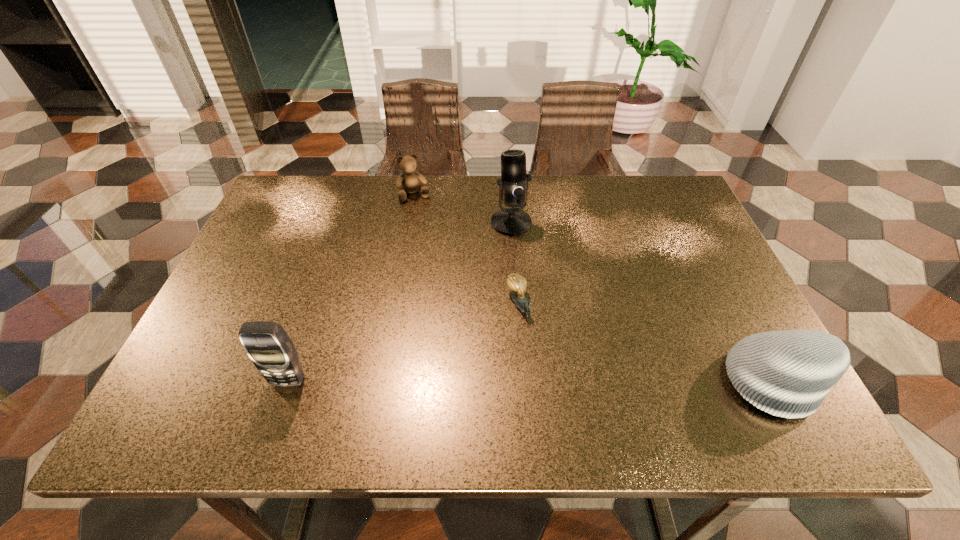
The height and width of the screenshot is (540, 960). Find the location of `the leftmost object`. the leftmost object is located at coordinates (267, 344).

At what (x,y) coordinates should I click in order to perform the action: click on cellular telephone. Please return your answer as a coordinate pair (x, y). This screenshot has width=960, height=540. Looking at the image, I should click on (267, 344).

Locate an element on the screen. Image resolution: width=960 pixels, height=540 pixels. the rightmost object is located at coordinates (788, 373).

The width and height of the screenshot is (960, 540). I want to click on the second farthest object, so click(513, 185).

Image resolution: width=960 pixels, height=540 pixels. Identify the location of the tallest object. (513, 185).

Image resolution: width=960 pixels, height=540 pixels. What are the coordinates of `the fourth object from right to left` in the screenshot? It's located at (408, 181).

I want to click on teddy bear, so click(408, 181).

This screenshot has height=540, width=960. I want to click on the shortest object, so click(517, 284).

Identify the location of the third nearest object. [x=517, y=284].

In order to click on vacant space positioned 0.270m on the back of the rightmost object in this screenshot , I will do `click(713, 260)`.